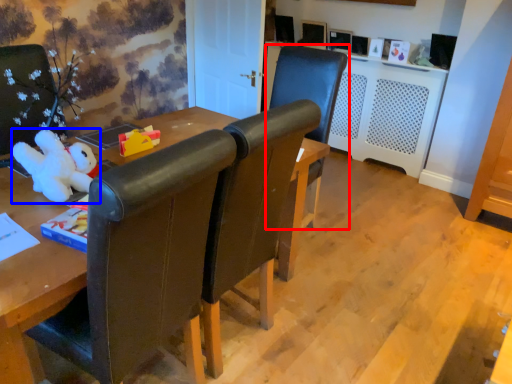
Question: Which of the following is the closest to the observer, chair (highlighted by a red box) or toy (highlighted by a blue box)?

Choices:
 (A) chair
 (B) toy

Answer: (B)